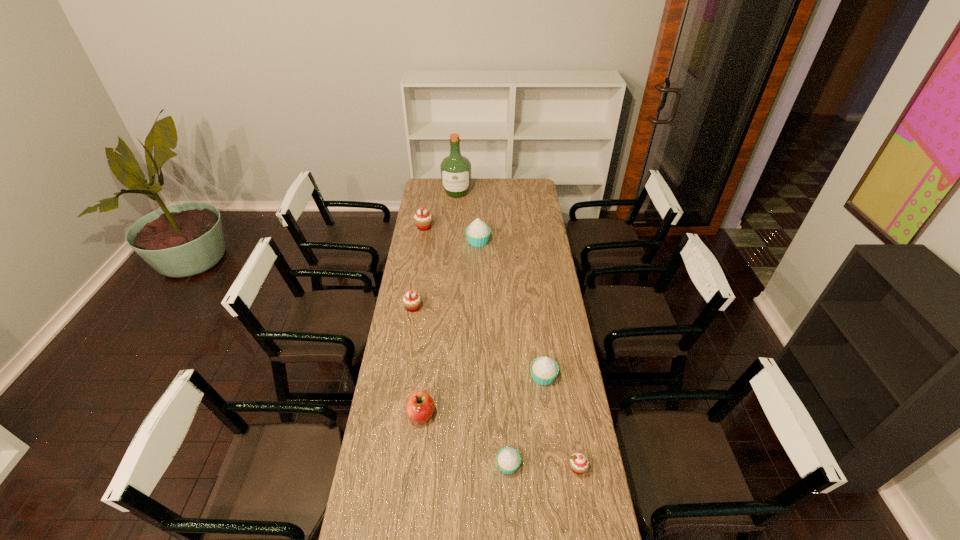
What are the coordinates of `vacant space located on the front of the nearest white cupcake` in the screenshot? It's located at (510, 503).

Find the location of a particular element. The width and height of the screenshot is (960, 540). vacant area situated 0.150m on the front of the rightmost pink cupcake is located at coordinates (588, 527).

I want to click on object situated at the far edge, so click(455, 169).

Locate an element on the screen. This screenshot has width=960, height=540. liquor located at the left edge is located at coordinates (455, 169).

The width and height of the screenshot is (960, 540). I want to click on apple located at the left edge, so click(420, 406).

This screenshot has width=960, height=540. Find the location of `object present at the far left corner`. object present at the far left corner is located at coordinates (455, 169).

At what (x,y) coordinates should I click in order to perform the action: click on vacant area at the far edge. Please return your answer as a coordinate pair (x, y). The width and height of the screenshot is (960, 540). Looking at the image, I should click on [x=480, y=195].

This screenshot has height=540, width=960. Find the location of `free space at the left edge of the desktop`. free space at the left edge of the desktop is located at coordinates (356, 512).

I want to click on vacant space at the right edge of the desktop, so 569,393.

In the image, there is a desktop. Where is `vacant space at the far right corner`? This screenshot has height=540, width=960. vacant space at the far right corner is located at coordinates (523, 187).